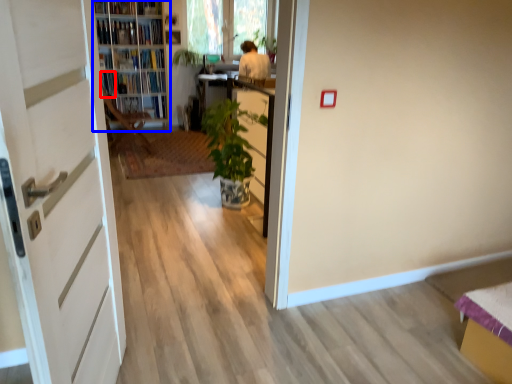
Question: Which point is further to the camera, book (highlighted by a red box) or shelf (highlighted by a blue box)?

Choices:
 (A) book
 (B) shelf

Answer: (A)